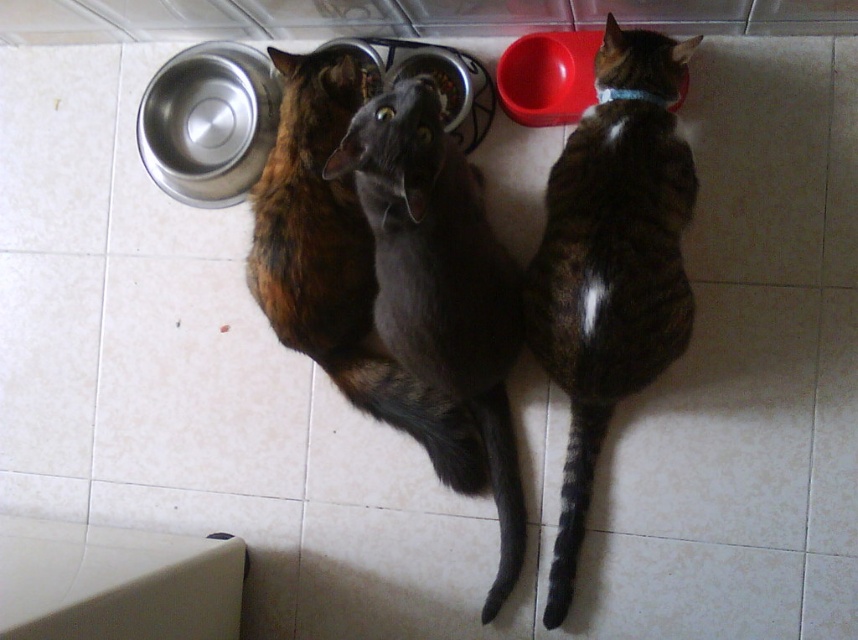
Question: Among these points, which one is nearest to the camera?

Choices:
 (A) 611,157
 (B) 418,304
 (C) 378,84
 (D) 384,410

Answer: (A)

Question: Which point is closer to the camera taking this photo?

Choices:
 (A) (363, 64)
 (B) (601, 262)

Answer: (B)

Question: Does calico fur cat at center appear on the left side of metallic silver bowl at center?

Choices:
 (A) no
 (B) yes

Answer: (B)

Question: Estimate the real-world distances between objects in this image. Which object is closer to the shiny gray cat at center?

Choices:
 (A) brushed metal bowl at upper center
 (B) calico fur cat at center
 (C) metallic silver bowl at center

Answer: (B)

Question: From the image, what is the correct spatial relationship of calico fur cat at center in relation to metallic silver bowl at center?

Choices:
 (A) below
 (B) above

Answer: (A)

Question: Can you confirm if shiny gray cat at center is smaller than calico fur cat at center?

Choices:
 (A) yes
 (B) no

Answer: (B)